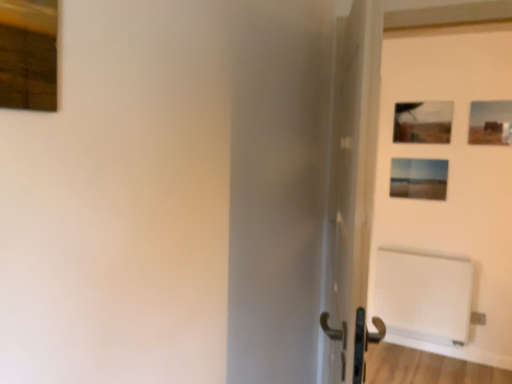
What do you see at coordinates (424, 295) in the screenshot? I see `white textured radiator at lower right` at bounding box center [424, 295].

Measure the distance between white textured radiator at lower right and camera.

The depth of white textured radiator at lower right is 3.11 meters.

This screenshot has height=384, width=512. In order to click on wooden frame at upper left, which ranks as the 1th picture frame in front-to-back order in this screenshot , I will do `click(28, 54)`.

Find the location of a particular element. white textured radiator at lower right is located at coordinates (424, 295).

Is white textured radiator at lower right wider or thinner than matte wooden picture frame at upper right, arranged as the third picture frame when viewed from the back?

Considering their sizes, white textured radiator at lower right looks broader than matte wooden picture frame at upper right, arranged as the third picture frame when viewed from the back.

How many degrees apart are the facing directions of white textured radiator at lower right and matte wooden picture frame at upper right, positioned as the 4th picture frame in left-to-right order?

The facing directions of white textured radiator at lower right and matte wooden picture frame at upper right, positioned as the 4th picture frame in left-to-right order, are 0.855 degrees apart.

Consider the image. Can you confirm if white textured radiator at lower right is shorter than matte wooden picture frame at upper right, positioned as the 4th picture frame in left-to-right order?

No.

From the picture: Does white textured radiator at lower right have a smaller size compared to matte wooden picture frame at upper right, arranged as the third picture frame when viewed from the back?

Actually, white textured radiator at lower right might be larger than matte wooden picture frame at upper right, arranged as the third picture frame when viewed from the back.

Is matte wooden picture frame at upper right, arranged as the third picture frame when viewed from the back, oriented towards white matte door at center?

Yes, matte wooden picture frame at upper right, arranged as the third picture frame when viewed from the back, is oriented towards white matte door at center.

Find the location of `the 3rd picture frame counting from the right side of the white matte door at center`. the 3rd picture frame counting from the right side of the white matte door at center is located at coordinates point(490,123).

Would you say white matte door at center is part of matte wooden picture frame at upper right, acting as the first picture frame starting from the right,'s contents?

Definitely not — white matte door at center is not inside matte wooden picture frame at upper right, acting as the first picture frame starting from the right.

Is matte wooden picture frame at upper right, which is the 2th picture frame in front-to-back order, in front of white matte door at center?

No, matte wooden picture frame at upper right, which is the 2th picture frame in front-to-back order, is further to the viewer.

From the picture: From a real-world perspective, does wooden frame at upper left, the first picture frame in the left-to-right sequence, sit lower than white matte door at center?

Incorrect, from a real-world perspective, wooden frame at upper left, the first picture frame in the left-to-right sequence, is higher than white matte door at center.

Which is farther, (18, 23) or (362, 180)?

The point (362, 180) is farther.

Considering the relative sizes of wooden frame at upper left, the 4th picture frame in the right-to-left sequence, and white matte door at center in the image provided, is wooden frame at upper left, the 4th picture frame in the right-to-left sequence, thinner than white matte door at center?

Yes.

Which of these two, wooden frame at upper left, the first picture frame in the left-to-right sequence, or matte wooden picture frame at upper right, which is the 2th picture frame in front-to-back order, is wider?

matte wooden picture frame at upper right, which is the 2th picture frame in front-to-back order, is wider.

From the image's perspective, between wooden frame at upper left, the 4th picture frame in the right-to-left sequence, and matte wooden picture frame at upper right, acting as the first picture frame starting from the right, which one is located above?

matte wooden picture frame at upper right, acting as the first picture frame starting from the right, from the image's perspective.

Is wooden frame at upper left, which ranks as the 1th picture frame in front-to-back order, directly adjacent to matte wooden picture frame at upper right, arranged as the third picture frame when viewed from the back?

There is a gap between wooden frame at upper left, which ranks as the 1th picture frame in front-to-back order, and matte wooden picture frame at upper right, arranged as the third picture frame when viewed from the back.

Is matte wooden picture frame at upper right, positioned as the 4th picture frame in left-to-right order, completely or partially inside wooden frame at upper left, which ranks as the 1th picture frame in front-to-back order?

No, matte wooden picture frame at upper right, positioned as the 4th picture frame in left-to-right order, is not inside wooden frame at upper left, which ranks as the 1th picture frame in front-to-back order.

Who is taller, white matte door at center or matte wooden picture frame at center-right, which ranks as the 2th picture frame in left-to-right order?

Standing taller between the two is white matte door at center.

Considering the sizes of white matte door at center and matte wooden picture frame at center-right, positioned as the 1th picture frame in back-to-front order, in the image, is white matte door at center wider or thinner than matte wooden picture frame at center-right, positioned as the 1th picture frame in back-to-front order,?

Considering their sizes, white matte door at center looks broader than matte wooden picture frame at center-right, positioned as the 1th picture frame in back-to-front order.

From the image's perspective, who appears lower, white matte door at center or matte wooden picture frame at center-right, which ranks as the fourth picture frame in front-to-back order?

white matte door at center.

From a real-world perspective, is white matte door at center physically above matte wooden picture frame at center-right, which ranks as the fourth picture frame in front-to-back order?

Answer: No, from a real-world perspective, white matte door at center is not above matte wooden picture frame at center-right, which ranks as the fourth picture frame in front-to-back order.

Is matte wooden picture frame at center-right, positioned as the 1th picture frame in back-to-front order, situated inside matte black picture frame at upper right, which is the 2th picture frame in back-to-front order, or outside?

matte wooden picture frame at center-right, positioned as the 1th picture frame in back-to-front order, is outside matte black picture frame at upper right, which is the 2th picture frame in back-to-front order.

From a real-world perspective, is matte wooden picture frame at center-right, which ranks as the 2th picture frame in left-to-right order, positioned over matte black picture frame at upper right, the 3th picture frame from the front, based on gravity?

No, from a real-world perspective, matte wooden picture frame at center-right, which ranks as the 2th picture frame in left-to-right order, is not on top of matte black picture frame at upper right, the 3th picture frame from the front.

Between matte wooden picture frame at center-right, which ranks as the 2th picture frame in left-to-right order, and matte black picture frame at upper right, the 3th picture frame from the front, which one has smaller width?

With smaller width is matte black picture frame at upper right, the 3th picture frame from the front.

Is the depth of matte wooden picture frame at center-right, positioned as the 1th picture frame in back-to-front order, less than that of matte black picture frame at upper right, which is the 2th picture frame in back-to-front order?

No, matte wooden picture frame at center-right, positioned as the 1th picture frame in back-to-front order, is further to the viewer.

Is wooden frame at upper left, the 4th picture frame from the back, wider than white textured radiator at lower right?

In fact, wooden frame at upper left, the 4th picture frame from the back, might be narrower than white textured radiator at lower right.

Between wooden frame at upper left, the first picture frame in the left-to-right sequence, and white textured radiator at lower right, which one has smaller size?

wooden frame at upper left, the first picture frame in the left-to-right sequence, is smaller.

Does wooden frame at upper left, the first picture frame in the left-to-right sequence, have a greater height compared to white textured radiator at lower right?

In fact, wooden frame at upper left, the first picture frame in the left-to-right sequence, may be shorter than white textured radiator at lower right.

In order to click on radiator behind the matte wooden picture frame at upper right, which is the 2th picture frame in front-to-back order in this screenshot , I will do `click(424, 295)`.

Where is `door below the matte wooden picture frame at upper right, arranged as the third picture frame when viewed from the back (from a real-world perspective)`? The image size is (512, 384). door below the matte wooden picture frame at upper right, arranged as the third picture frame when viewed from the back (from a real-world perspective) is located at coordinates (351, 192).

Estimate the real-world distances between objects in this image. Which object is closer to matte black picture frame at upper right, which is the 2th picture frame in back-to-front order, white matte door at center or matte wooden picture frame at upper right, acting as the first picture frame starting from the right?

Based on the image, matte wooden picture frame at upper right, acting as the first picture frame starting from the right, appears to be nearer to matte black picture frame at upper right, which is the 2th picture frame in back-to-front order.

Estimate the real-world distances between objects in this image. Which object is closer to matte wooden picture frame at upper right, which is the 2th picture frame in front-to-back order, matte wooden picture frame at center-right, which ranks as the 2th picture frame in left-to-right order, or wooden frame at upper left, the first picture frame in the left-to-right sequence?

matte wooden picture frame at center-right, which ranks as the 2th picture frame in left-to-right order, lies closer to matte wooden picture frame at upper right, which is the 2th picture frame in front-to-back order, than the other object.

When comparing their distances from wooden frame at upper left, the 4th picture frame from the back, does matte wooden picture frame at upper right, positioned as the 4th picture frame in left-to-right order, or white matte door at center seem further?

The object further to wooden frame at upper left, the 4th picture frame from the back, is matte wooden picture frame at upper right, positioned as the 4th picture frame in left-to-right order.

Estimate the real-world distances between objects in this image. Which object is further from matte wooden picture frame at upper right, acting as the first picture frame starting from the right, white matte door at center or matte black picture frame at upper right, the 3th picture frame from the front?

white matte door at center.

Based on the photo, from the image, which object appears to be nearer to white matte door at center, white textured radiator at lower right or wooden frame at upper left, which ranks as the 1th picture frame in front-to-back order?

wooden frame at upper left, which ranks as the 1th picture frame in front-to-back order.

Estimate the real-world distances between objects in this image. Which object is further from matte wooden picture frame at center-right, which ranks as the 2th picture frame in left-to-right order, white textured radiator at lower right or white matte door at center?

The object further to matte wooden picture frame at center-right, which ranks as the 2th picture frame in left-to-right order, is white matte door at center.

Considering their positions, is matte wooden picture frame at upper right, acting as the first picture frame starting from the right, positioned closer to matte wooden picture frame at center-right, positioned as the 1th picture frame in back-to-front order, than white textured radiator at lower right?

matte wooden picture frame at upper right, acting as the first picture frame starting from the right, is positioned closer to the anchor matte wooden picture frame at center-right, positioned as the 1th picture frame in back-to-front order.

Considering their positions, is matte wooden picture frame at upper right, which is the 2th picture frame in front-to-back order, positioned further to matte black picture frame at upper right, the 3th picture frame from the front, than white matte door at center?

Based on the image, white matte door at center appears to be further to matte black picture frame at upper right, the 3th picture frame from the front.

Image resolution: width=512 pixels, height=384 pixels. I want to click on radiator positioned between wooden frame at upper left, which ranks as the 1th picture frame in front-to-back order, and matte wooden picture frame at center-right, positioned as the 1th picture frame in back-to-front order, from near to far, so click(x=424, y=295).

Where is `door positioned between wooden frame at upper left, the 4th picture frame from the back, and matte wooden picture frame at upper right, which is the 2th picture frame in front-to-back order, from near to far`? This screenshot has width=512, height=384. door positioned between wooden frame at upper left, the 4th picture frame from the back, and matte wooden picture frame at upper right, which is the 2th picture frame in front-to-back order, from near to far is located at coordinates (351, 192).

At what (x,y) coordinates should I click in order to perform the action: click on picture frame located between wooden frame at upper left, which ranks as the 1th picture frame in front-to-back order, and matte black picture frame at upper right, marked as the second picture frame in a right-to-left arrangement, in the depth direction. Please return your answer as a coordinate pair (x, y). The image size is (512, 384). Looking at the image, I should click on (490, 123).

Locate an element on the screen. This screenshot has height=384, width=512. radiator located between white matte door at center and matte wooden picture frame at center-right, which ranks as the fourth picture frame in front-to-back order, in the depth direction is located at coordinates (424, 295).